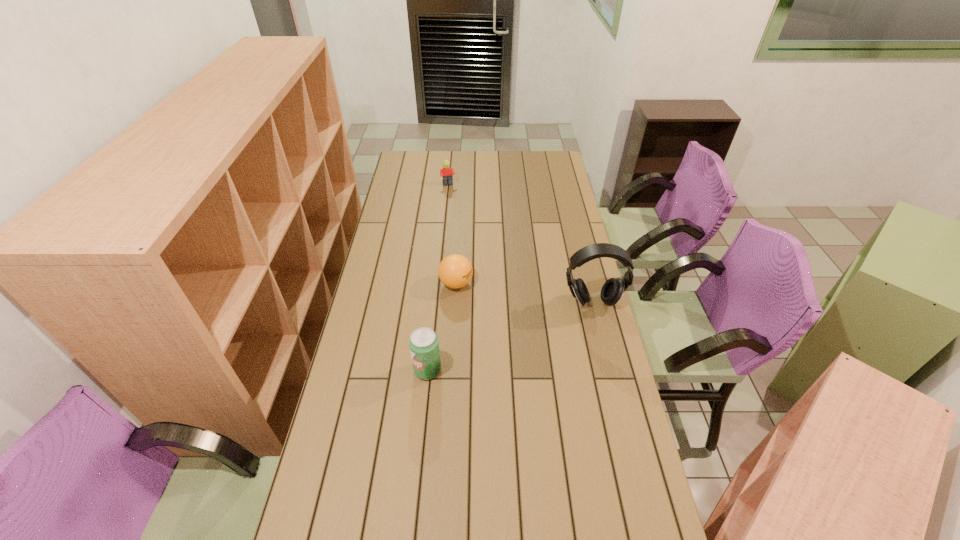
The height and width of the screenshot is (540, 960). Find the location of `soda`. soda is located at coordinates (424, 347).

Where is `the nearest object`? This screenshot has width=960, height=540. the nearest object is located at coordinates (424, 347).

Find the location of a particular element. This screenshot has width=960, height=540. earphone is located at coordinates (612, 290).

Where is `the tallest object`? The width and height of the screenshot is (960, 540). the tallest object is located at coordinates (612, 290).

The height and width of the screenshot is (540, 960). Find the location of `the farthest object`. the farthest object is located at coordinates (446, 173).

Where is `ping-pong ball`? The width and height of the screenshot is (960, 540). ping-pong ball is located at coordinates (455, 271).

Where is `vacant point located on the front of the nearest object`? The image size is (960, 540). vacant point located on the front of the nearest object is located at coordinates (421, 429).

I want to click on vacant area located 0.260m on the ear cups of the tallest object, so click(610, 372).

You are a GUI agent. You are given a task and a screenshot of the screen. Output one action in this format:
    pyautogui.click(x=<x>, y=<y>)
    Task: Click on the free space located 0.290m on the face of the Lego
    The image size is (960, 540).
    Given the screenshot: What is the action you would take?
    pyautogui.click(x=460, y=222)

Where is `free space located 0.170m on the face of the Lego`? This screenshot has height=540, width=960. free space located 0.170m on the face of the Lego is located at coordinates (456, 207).